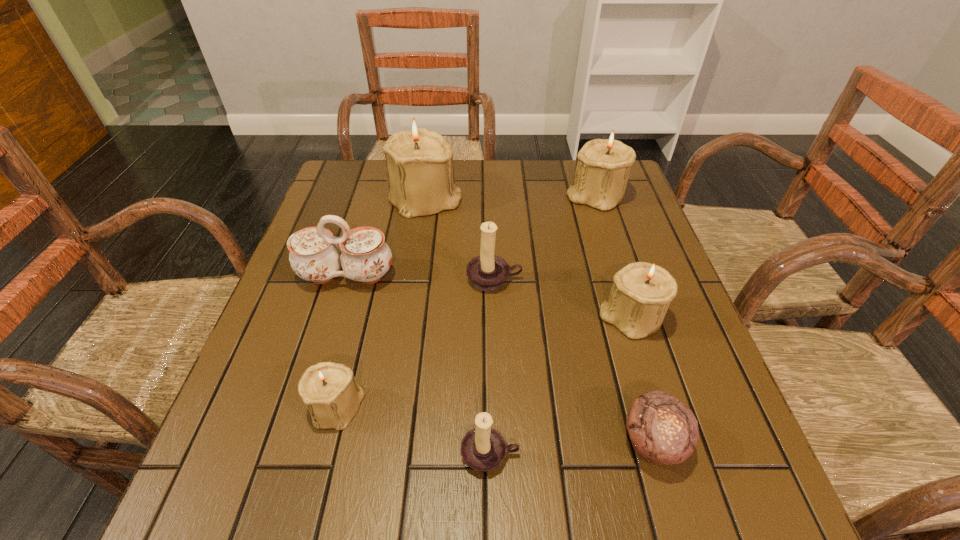
Choose which beige candle_holder is the second nearest neighbor to the biggest beige candle_holder. Please provide its 2D coordinates. Your answer should be formatted as a tuple, i.e. [(x, y)], where the tuple contains the x and y coordinates of a point satisfying the conditions above.

[(641, 292)]

You are a GUI agent. You are given a task and a screenshot of the screen. Output one action in this format:
    pyautogui.click(x=<x>, y=<y>)
    Task: Click on the free location that satisfies the following two spatial constraints: 1. by the handle of the third nearest candle holder; 2. on the right side of the chinaware
    The width and height of the screenshot is (960, 540).
    Given the screenshot: What is the action you would take?
    pyautogui.click(x=334, y=318)